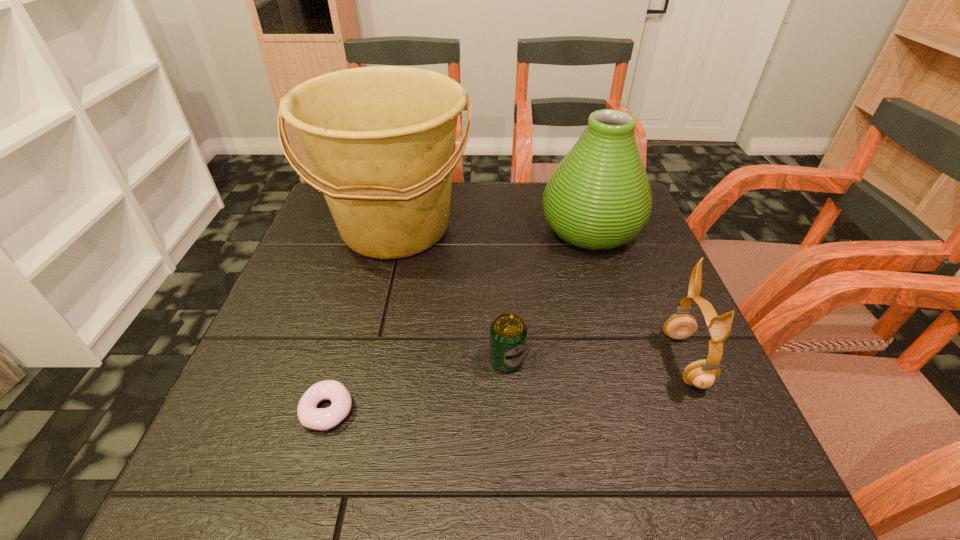
I want to click on object present at the far right corner, so click(x=599, y=197).

Image resolution: width=960 pixels, height=540 pixels. In the image, there is a desktop. In order to click on vacant region at the far edge in this screenshot , I will do `click(480, 196)`.

Identify the location of free region at the near edge of the desktop. (383, 492).

I want to click on free space at the left edge of the desktop, so click(285, 281).

At what (x,y) coordinates should I click in order to perform the action: click on vacant position at the right edge of the desktop. Please return your answer as a coordinate pair (x, y). Image resolution: width=960 pixels, height=540 pixels. Looking at the image, I should click on (602, 270).

This screenshot has height=540, width=960. I want to click on empty location between the third object from left to right and the vase, so click(549, 294).

At what (x,y) coordinates should I click in order to perform the action: click on vacant space that is in between the second tallest object and the bucket. Please return your answer as a coordinate pair (x, y). This screenshot has width=960, height=540. Looking at the image, I should click on (493, 228).

Where is `vacant area that lies between the earphone and the shortest object`? The height and width of the screenshot is (540, 960). vacant area that lies between the earphone and the shortest object is located at coordinates (506, 385).

Where is `free space that is in between the shortest object and the earphone`? free space that is in between the shortest object and the earphone is located at coordinates (506, 385).

The width and height of the screenshot is (960, 540). What are the coordinates of `free area in between the bucket and the beer can` in the screenshot? It's located at (x=451, y=294).